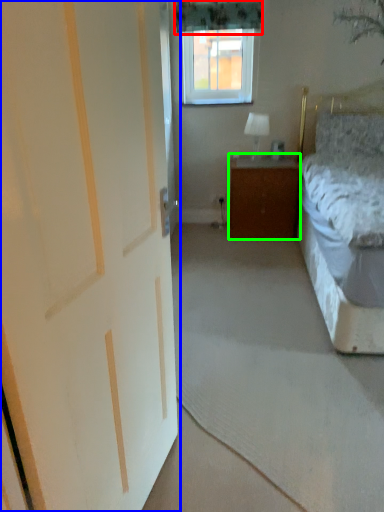
Question: Based on their relative distances, which object is nearer to curtain (highlighted by a red box)? Choose from door (highlighted by a blue box) and cabinetry (highlighted by a green box).

Choices:
 (A) door
 (B) cabinetry

Answer: (B)